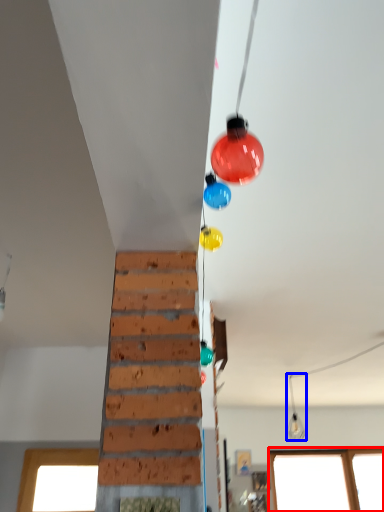
Question: Which object is further to the camera taking this photo, window (highlighted by a red box) or light fixture (highlighted by a blue box)?

Choices:
 (A) window
 (B) light fixture

Answer: (A)